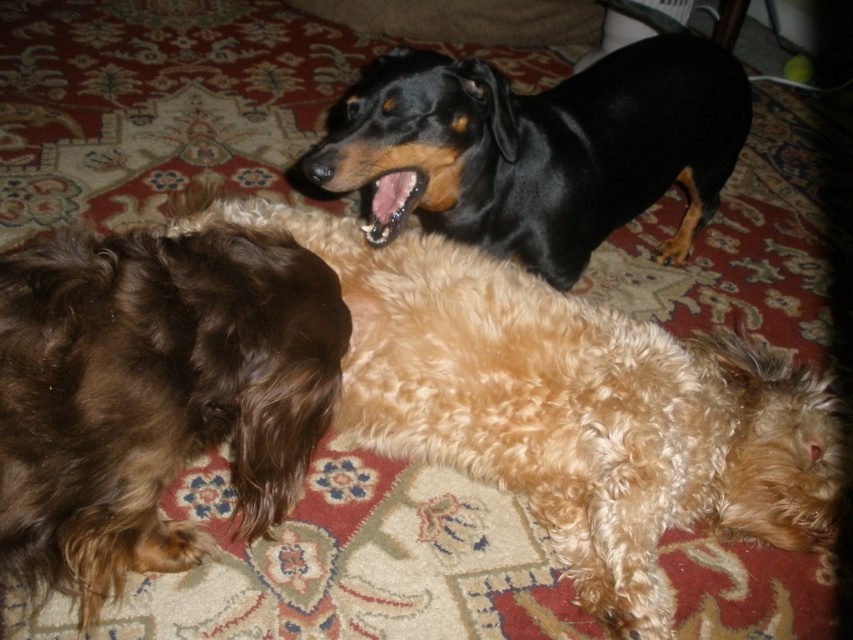
Question: Is brown fuzzy dog at lower left in front of black shiny dog at upper center?

Choices:
 (A) no
 (B) yes

Answer: (B)

Question: Can you confirm if brown curly fur dog at upper left is positioned above black shiny dog at upper center?

Choices:
 (A) no
 (B) yes

Answer: (A)

Question: Can you confirm if brown curly fur dog at upper left is positioned to the left of black shiny dog at upper center?

Choices:
 (A) no
 (B) yes

Answer: (B)

Question: Considering the real-world distances, which object is closest to the brown curly fur dog at upper left?

Choices:
 (A) brown fuzzy dog at lower left
 (B) black shiny dog at upper center

Answer: (A)

Question: Considering the real-world distances, which object is farthest from the brown fuzzy dog at lower left?

Choices:
 (A) black shiny dog at upper center
 (B) brown curly fur dog at upper left

Answer: (A)

Question: Which of these objects is positioned farthest from the brown fuzzy dog at lower left?

Choices:
 (A) black shiny dog at upper center
 (B) brown curly fur dog at upper left

Answer: (A)